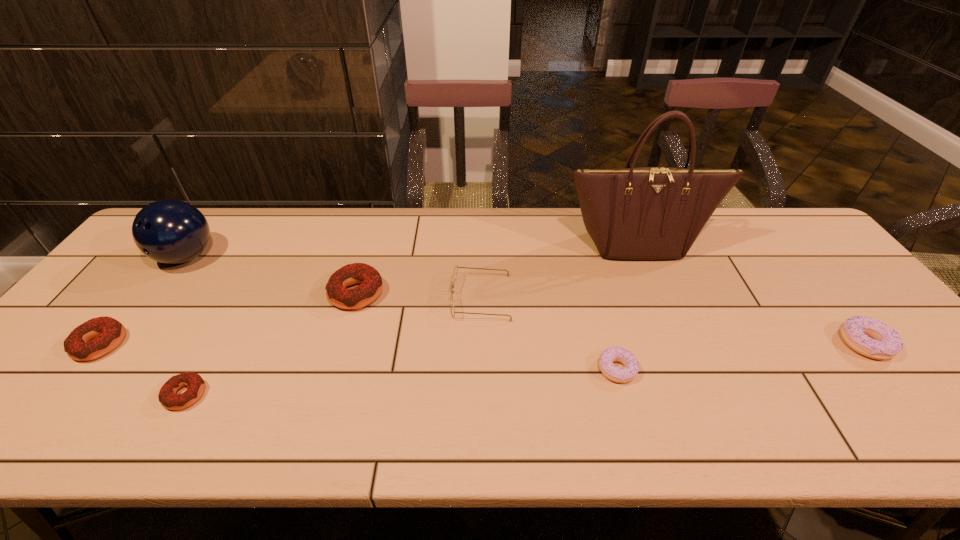
In order to click on free space between the seventh shortest object and the left purple doughnut in this screenshot , I will do `click(402, 313)`.

Locate an element on the screen. The width and height of the screenshot is (960, 540). free space that is in between the fourth object from right to left and the right purple doughnut is located at coordinates (673, 321).

I want to click on vacant area between the spectacles and the farthest chocolate doughnut, so click(x=419, y=295).

Locate an element on the screen. The height and width of the screenshot is (540, 960). vacant region between the tallest object and the rightmost object is located at coordinates (751, 294).

Identify the location of free space between the spectacles and the third doughnut from right to left. (419, 295).

Where is `the fourth closest object to the handbag`? The height and width of the screenshot is (540, 960). the fourth closest object to the handbag is located at coordinates (371, 285).

The height and width of the screenshot is (540, 960). Identify the location of object that is the third closest to the blue bowling ball. (371, 285).

Select which doughnut is the fourth closest to the second biggest chocolate doughnut. Please provide its 2D coordinates. Your answer should be formatted as a tuple, i.e. [(x, y)], where the tuple contains the x and y coordinates of a point satisfying the conditions above.

[(857, 331)]

Identify the location of doughnut that is the fourth nearest to the biggest chocolate doughnut. The image size is (960, 540). (857, 331).

Identify the location of chocolate doughnut that is the second nearest to the bowling ball. This screenshot has height=540, width=960. (195, 384).